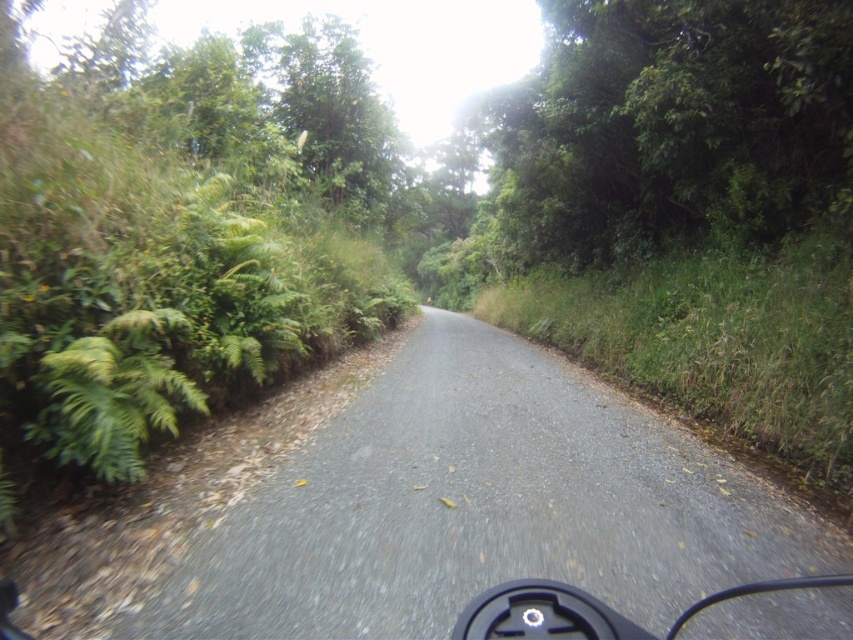
Does gray asphalt road at center come behind green leafy tree at upper center?

That is False.

Which is in front, point (299, 410) or point (729, 106)?

Positioned in front is point (299, 410).

Does point (730, 572) come closer to viewer compared to point (825, 186)?

Yes, it is in front of point (825, 186).

Locate an element on the screen. gray asphalt road at center is located at coordinates (424, 508).